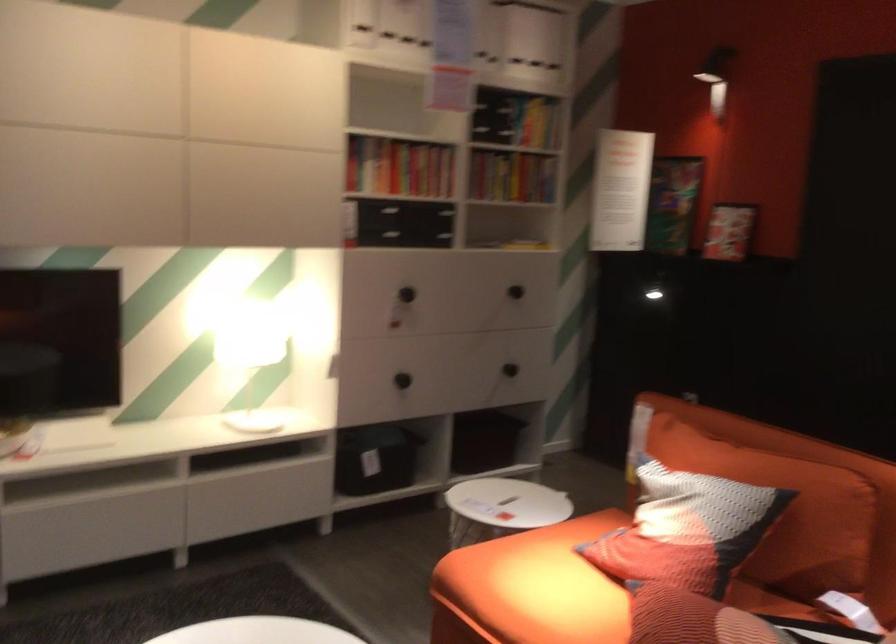
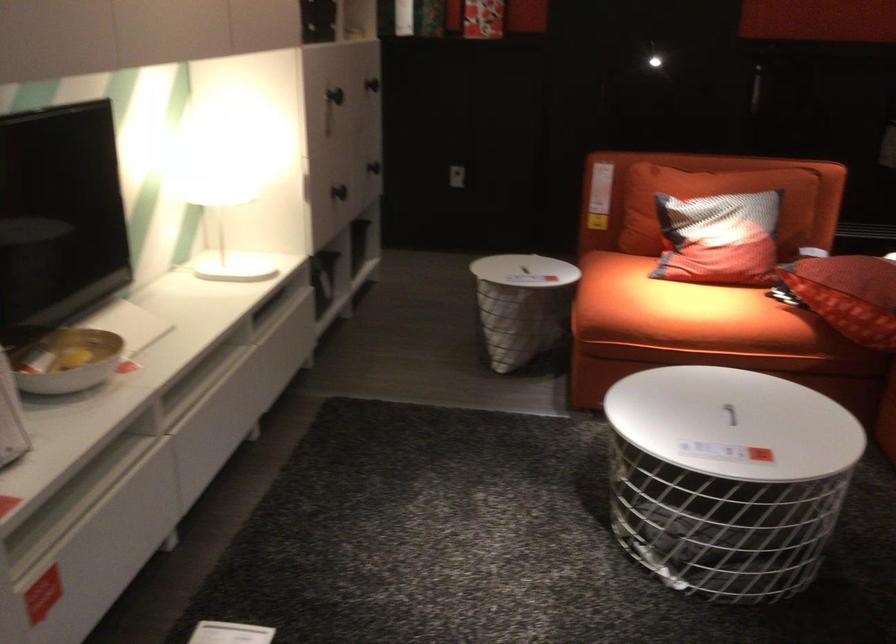
Find the pixel in the second image that matches (x=520, y=285) in the first image.

(372, 84)